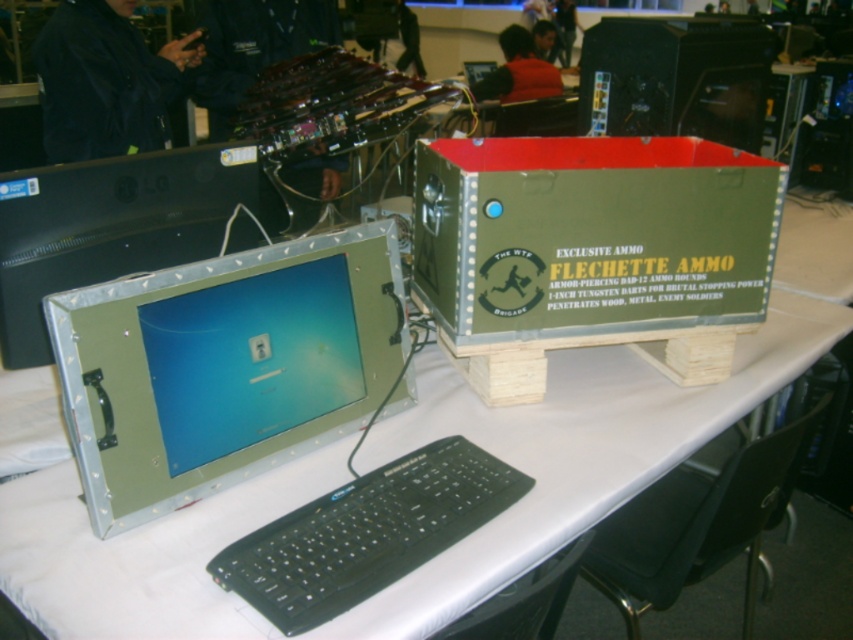
Question: Does olive green cardboard box at center come in front of metallic green monitor at center?

Choices:
 (A) no
 (B) yes

Answer: (A)

Question: Which of the following is the farthest from the observer?

Choices:
 (A) metallic green monitor at center
 (B) metallic silver monitor at center

Answer: (B)

Question: Which object is the farthest from the metallic silver monitor at center?

Choices:
 (A) black plastic keyboard at lower center
 (B) metallic green computer desk at center

Answer: (A)

Question: Can you confirm if metallic green monitor at center is positioned to the left of matte black desktop computer at upper right?

Choices:
 (A) no
 (B) yes

Answer: (B)

Question: Among these points, which one is nearest to the camera?

Choices:
 (A) (73, 260)
 (B) (495, 461)
 (C) (610, 129)
 (D) (519, 218)

Answer: (B)

Question: Is olive green cardboard box at center wider than black plastic keyboard at lower center?

Choices:
 (A) yes
 (B) no

Answer: (A)